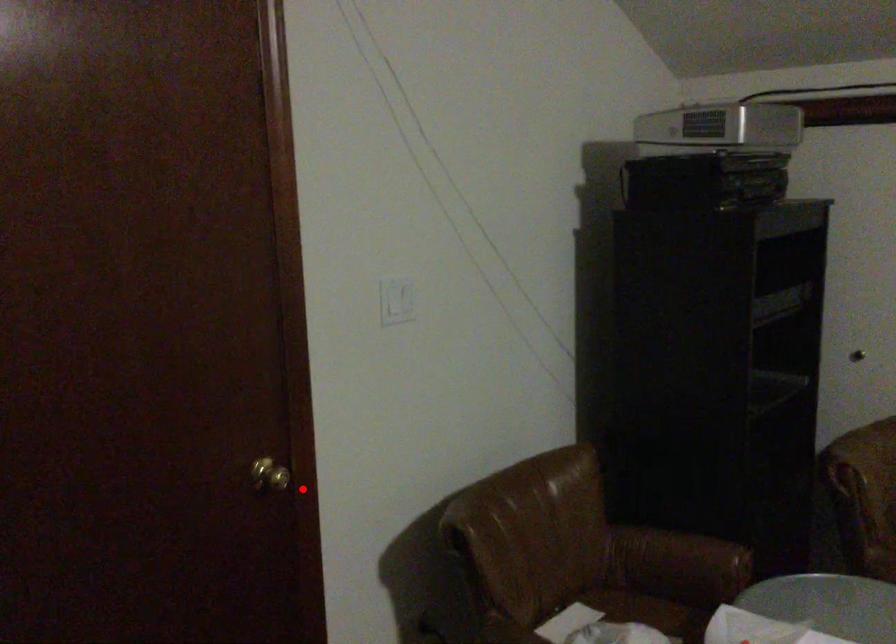
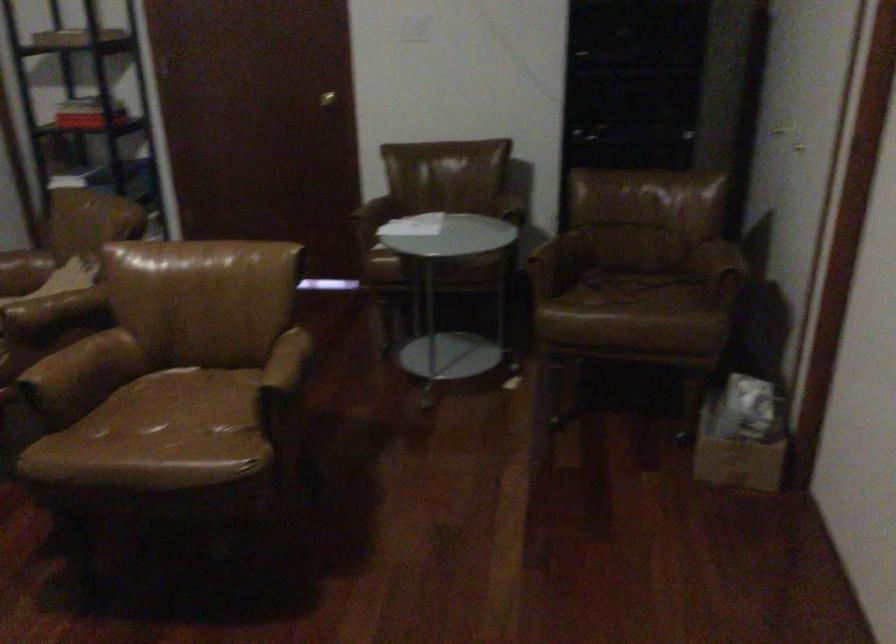
Question: A red point is marked in image1. In image2, is the corresponding 3D point closer to the camera or farther? Reply with the corresponding letter.

Choices:
 (A) The corresponding 3D point is closer.
 (B) The corresponding 3D point is farther.

Answer: (B)